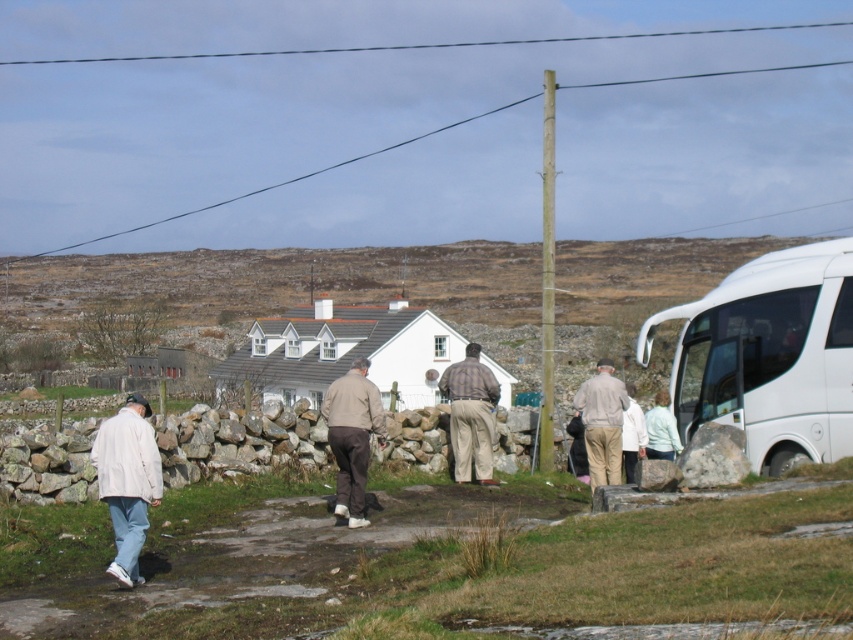
Does white glossy van at right have a greater width compared to light brown fabric pants at center?

Indeed, white glossy van at right has a greater width compared to light brown fabric pants at center.

In the scene shown: Can you confirm if white glossy van at right is thinner than light brown fabric pants at center?

No, white glossy van at right is not thinner than light brown fabric pants at center.

At what (x,y) coordinates should I click in order to perform the action: click on white glossy van at right. Please return your answer as a coordinate pair (x, y). Looking at the image, I should click on (769, 355).

At what (x,y) coordinates should I click in order to perform the action: click on white glossy van at right. Please return your answer as a coordinate pair (x, y). Looking at the image, I should click on (769, 355).

Between white matte jacket at lower left and light brown fabric pants at center, which one appears on the right side from the viewer's perspective?

light brown fabric pants at center is more to the right.

Between white matte jacket at lower left and light brown fabric pants at center, which one appears on the left side from the viewer's perspective?

white matte jacket at lower left is more to the left.

Does point (125, 536) come in front of point (596, 413)?

Yes, it is in front of point (596, 413).

Find the location of a particular element. The height and width of the screenshot is (640, 853). white matte jacket at lower left is located at coordinates (126, 481).

Between light brown fabric jacket at center and light brown fabric pants at center, which one appears on the right side from the viewer's perspective?

light brown fabric pants at center is more to the right.

Is point (340, 433) positioned in front of point (593, 376)?

Yes, point (340, 433) is in front of point (593, 376).

Where is `light brown fabric jacket at center`? light brown fabric jacket at center is located at coordinates (352, 436).